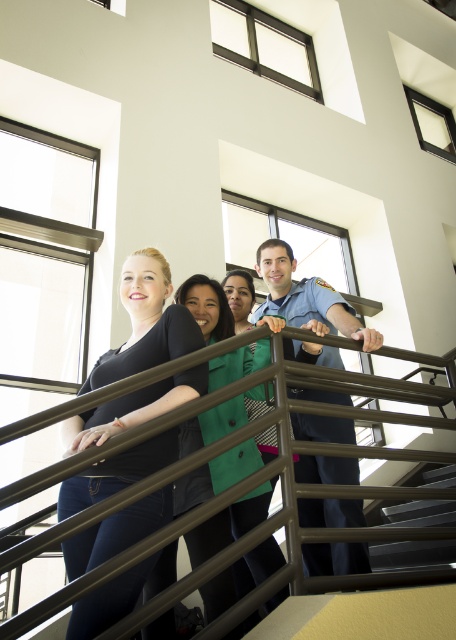
Which is more to the left, blue uniform at center or metallic gray stairs at lower right?

blue uniform at center

The height and width of the screenshot is (640, 456). Identify the location of blue uniform at center. (305, 296).

Does metallic brown railing at center have a greater height compared to metallic gray stairs at lower right?

Indeed, metallic brown railing at center has a greater height compared to metallic gray stairs at lower right.

Can you confirm if metallic brown railing at center is wider than metallic gray stairs at lower right?

Correct, the width of metallic brown railing at center exceeds that of metallic gray stairs at lower right.

Does point (190, 408) come behind point (373, 541)?

No, (190, 408) is closer to viewer.

What are the coordinates of `metallic brown railing at center` in the screenshot? It's located at pyautogui.click(x=213, y=442).

Is black matte shirt at center in front of metallic gray stairs at lower right?

Yes, it is in front of metallic gray stairs at lower right.

Does point (105, 472) come farther from viewer compared to point (413, 564)?

No, (105, 472) is in front of (413, 564).

Between point (188, 340) and point (404, 561), which one is positioned in front?

Point (188, 340) is more forward.

You are a GUI agent. You are given a task and a screenshot of the screen. Output one action in this format:
    pyautogui.click(x=<x>, y=<y>)
    Task: Click on the black matte shirt at center
    
    Given the screenshot: What is the action you would take?
    pyautogui.click(x=146, y=323)